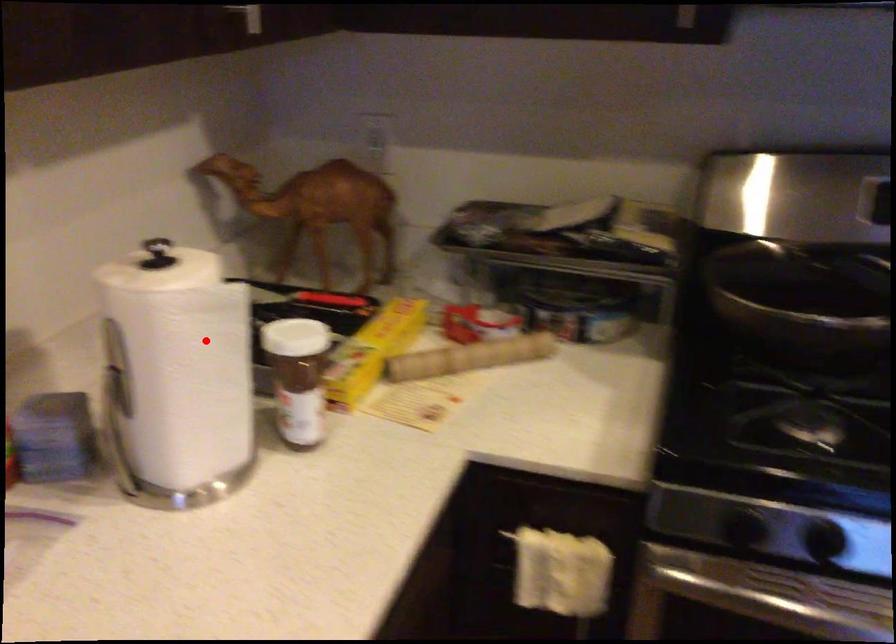
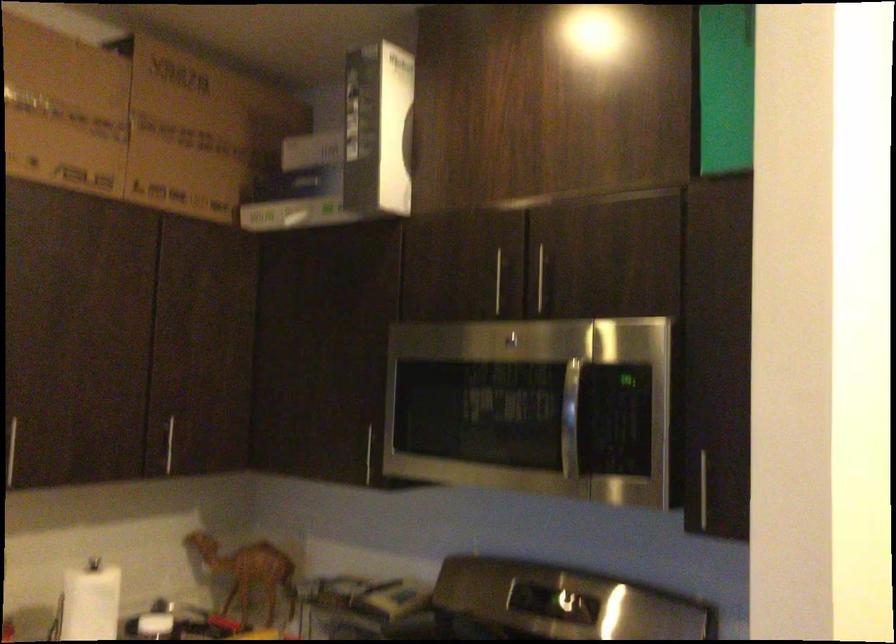
Question: I am providing you with two images of the same scene from different viewpoints. Image1 has a red point marked. In image2, the corresponding 3D location appears at what relative position? Reply with the corresponding letter.

Choices:
 (A) Closer
 (B) Farther

Answer: (B)